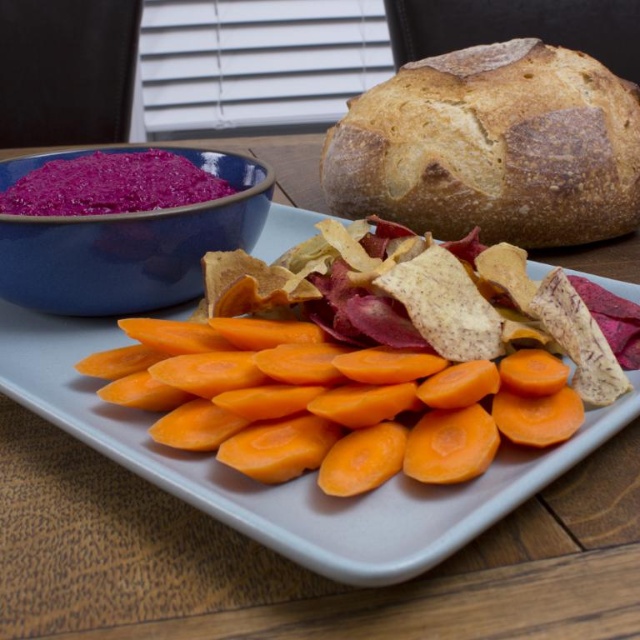
Is golden brown crusty loaf at upper right thinner than orange matte carrot slices at center?

Yes, golden brown crusty loaf at upper right is thinner than orange matte carrot slices at center.

Between point (499, 232) and point (307, 554), which one is positioned behind?

The point (499, 232) is more distant.

At what (x,y) coordinates should I click in order to perform the action: click on golden brown crusty loaf at upper right. Please return your answer as a coordinate pair (x, y). The image size is (640, 640). Looking at the image, I should click on (492, 147).

Between orange matte carrot slices at center and purple matte bowl at upper left, which one appears on the left side from the viewer's perspective?

Positioned to the left is purple matte bowl at upper left.

Who is shorter, orange matte carrot slices at center or purple matte bowl at upper left?

Standing shorter between the two is purple matte bowl at upper left.

Find the location of a particular element. The height and width of the screenshot is (640, 640). orange matte carrot slices at center is located at coordinates (289, 483).

Can you confirm if orange smooth carrot at center is wider than orange matte carrot slices at center?

Incorrect, orange smooth carrot at center's width does not surpass orange matte carrot slices at center's.

Does point (298, 404) lie in front of point (204, 499)?

That is False.

Which is in front, point (205, 394) or point (92, 426)?

Positioned in front is point (92, 426).

Identify the location of orange smooth carrot at center. The width and height of the screenshot is (640, 640). (332, 401).